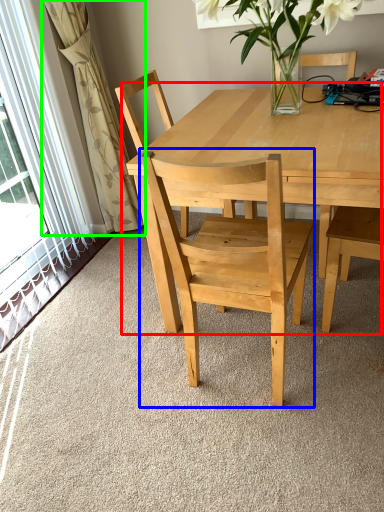
Question: Which object is positioned farthest from kitchen & dining room table (highlighted by a red box)? Select from chair (highlighted by a blue box) and curtain (highlighted by a green box).

Choices:
 (A) chair
 (B) curtain

Answer: (B)